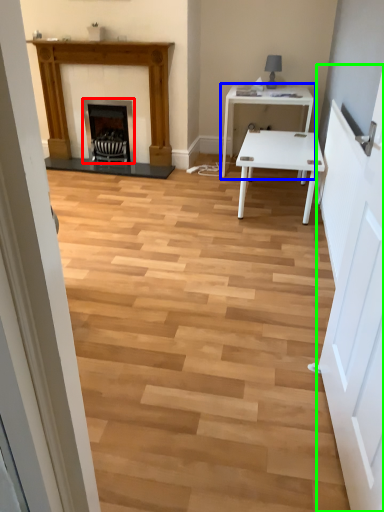
Question: Considering the real-world distances, which object is farthest from fireplace (highlighted by a red box)? table (highlighted by a blue box) or door (highlighted by a green box)?

Choices:
 (A) table
 (B) door

Answer: (B)